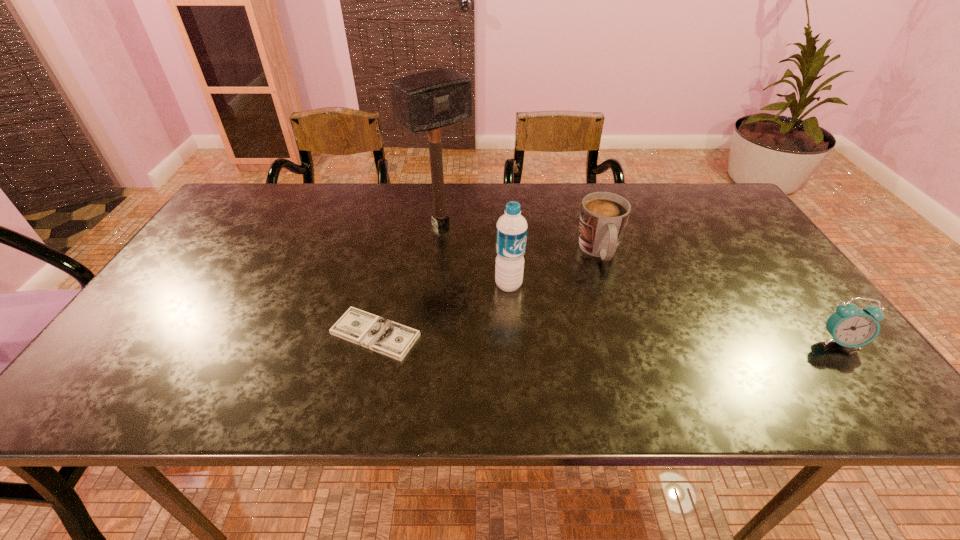
Find the location of a particular element. This screenshot has width=960, height=540. dollar is located at coordinates (x=387, y=337).

Image resolution: width=960 pixels, height=540 pixels. In order to click on the rightmost object in this screenshot , I will do `click(850, 326)`.

Image resolution: width=960 pixels, height=540 pixels. Find the location of `mug`. mug is located at coordinates (603, 217).

At what (x,y) coordinates should I click in order to perform the action: click on the fourth shortest object. Please return your answer as a coordinate pair (x, y). Looking at the image, I should click on coord(511,230).

I want to click on the third object from left to right, so click(511, 230).

At what (x,y) coordinates should I click in order to perform the action: click on the tallest object. Please return your answer as a coordinate pair (x, y). Looking at the image, I should click on (427, 101).

At what (x,y) coordinates should I click in order to perform the action: click on vacant space situated 0.380m on the right of the shortest object. Please return your answer as a coordinate pair (x, y). The height and width of the screenshot is (540, 960). Looking at the image, I should click on (588, 334).

Where is `vacant space situated 0.250m on the side of the second object from right to left with the handle`? This screenshot has width=960, height=540. vacant space situated 0.250m on the side of the second object from right to left with the handle is located at coordinates (x=631, y=348).

The image size is (960, 540). In order to click on vacant space situated on the side of the second object from right to left with the handle in this screenshot , I will do `click(618, 312)`.

Identify the location of vacant space located 0.230m on the side of the second object from right to left with the handle. This screenshot has height=540, width=960. (628, 341).